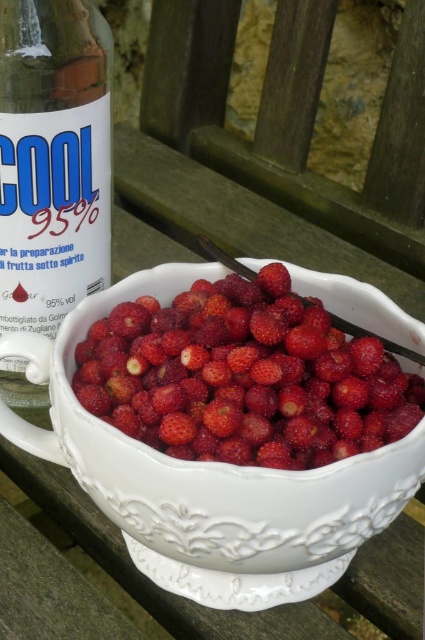
Between white porcelain bowl at center and matte glass bottle at left, which one has less height?

white porcelain bowl at center

Is point (302, 552) in front of point (37, 102)?

Yes, point (302, 552) is in front of point (37, 102).

You are a GUI agent. You are given a task and a screenshot of the screen. Output one action in this format:
    pyautogui.click(x=<x>, y=<y>)
    Task: Click on the white porcelain bowl at center
    The height and width of the screenshot is (640, 425).
    Given the screenshot: What is the action you would take?
    pyautogui.click(x=198, y=476)

Who is more forward, (302, 419) or (193, 481)?

Point (193, 481) is more forward.

Is point (164, 353) positioned before point (238, 577)?

That is True.

The height and width of the screenshot is (640, 425). I want to click on shiny red strawberries at center, so click(x=243, y=378).

Which is more to the right, shiny red strawberries at center or matte glass bottle at left?

shiny red strawberries at center

Does shiny red strawberries at center appear on the right side of matte glass bottle at left?

Indeed, shiny red strawberries at center is positioned on the right side of matte glass bottle at left.

Is point (223, 449) positioned behind point (87, 221)?

That is False.

The height and width of the screenshot is (640, 425). I want to click on shiny red strawberries at center, so click(x=243, y=378).